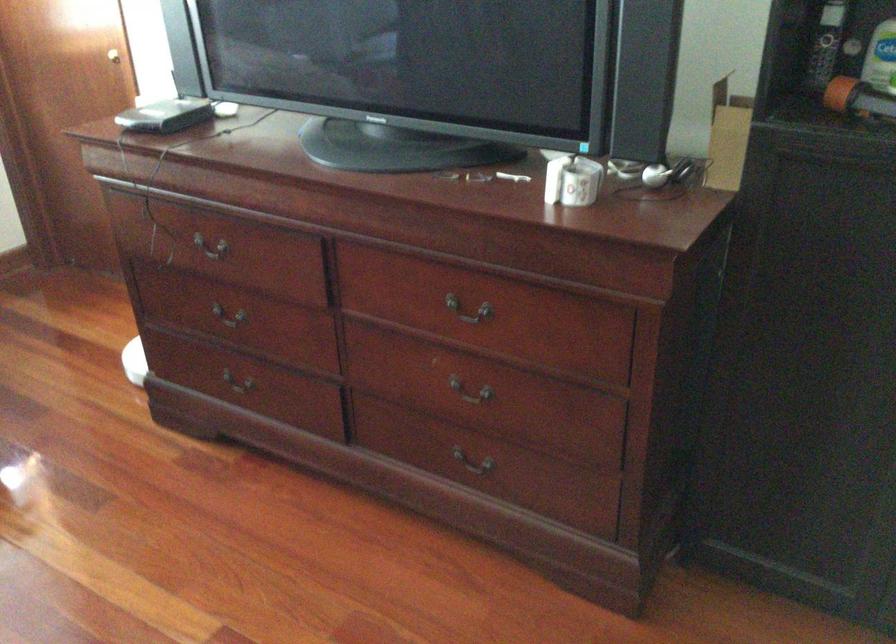
Image resolution: width=896 pixels, height=644 pixels. I want to click on brass doorknob, so click(x=113, y=55).